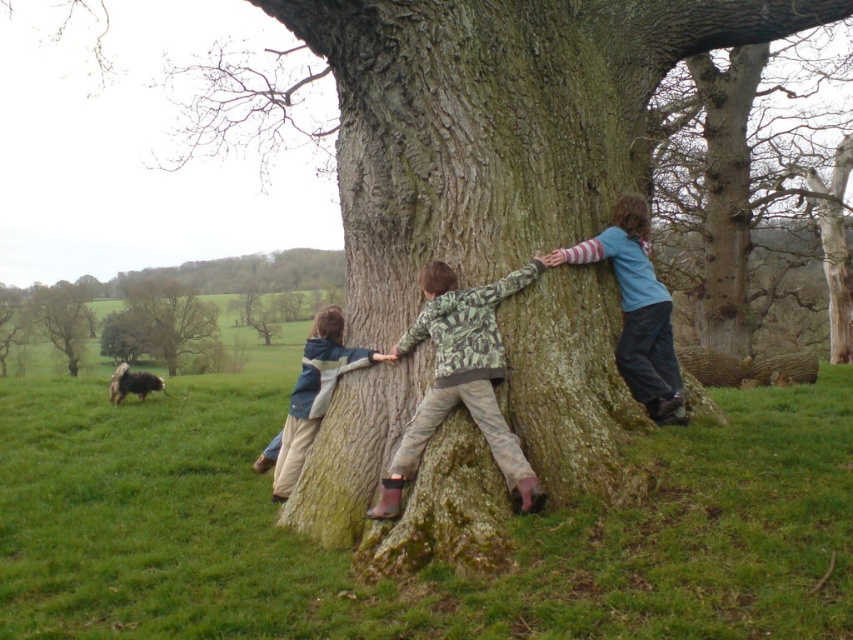
Question: Among these objects, which one is nearest to the camera?

Choices:
 (A) camouflage-patterned jacket at center
 (B) striped sweater at center
 (C) fuzzy wool dog at lower left
 (D) camouflage jacket at lower left

Answer: (A)

Question: Which point is closer to the camera?

Choices:
 (A) (73, 289)
 (B) (115, 378)
 (C) (614, 243)
 (D) (317, 396)

Answer: (C)

Question: Does smooth bark tree at left lie behind fuzzy wool dog at lower left?

Choices:
 (A) yes
 (B) no

Answer: (A)

Question: Is striped sweater at center wider than smooth bark tree at left?

Choices:
 (A) yes
 (B) no

Answer: (B)

Question: Can you confirm if striped sweater at center is bigger than smooth bark tree at left?

Choices:
 (A) no
 (B) yes

Answer: (A)

Question: Which point is closer to the camera taking this photo?

Choices:
 (A) (122, 374)
 (B) (126, 355)
 (C) (334, 378)

Answer: (C)